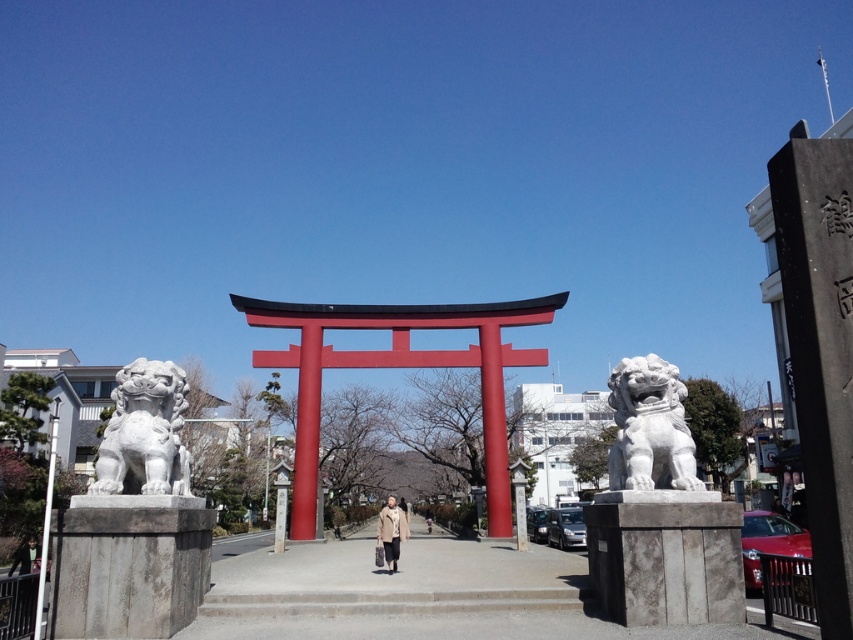
Question: Considering the real-world distances, which object is closest to the light brown textured coat at center?

Choices:
 (A) white stone lion at center
 (B) white stone lion at left

Answer: (B)

Question: Is white stone lion at left below light brown textured coat at center?

Choices:
 (A) yes
 (B) no

Answer: (B)

Question: Does white stone lion at left appear under light brown textured coat at center?

Choices:
 (A) yes
 (B) no

Answer: (B)

Question: Which of these objects is positioned farthest from the white stone lion at left?

Choices:
 (A) light brown textured coat at center
 (B) white stone lion at center

Answer: (B)

Question: Is white stone lion at left thinner than light brown textured coat at center?

Choices:
 (A) yes
 (B) no

Answer: (A)

Question: Which point is farther to the camera?

Choices:
 (A) (403, 515)
 (B) (640, 477)
 (C) (107, 429)

Answer: (A)